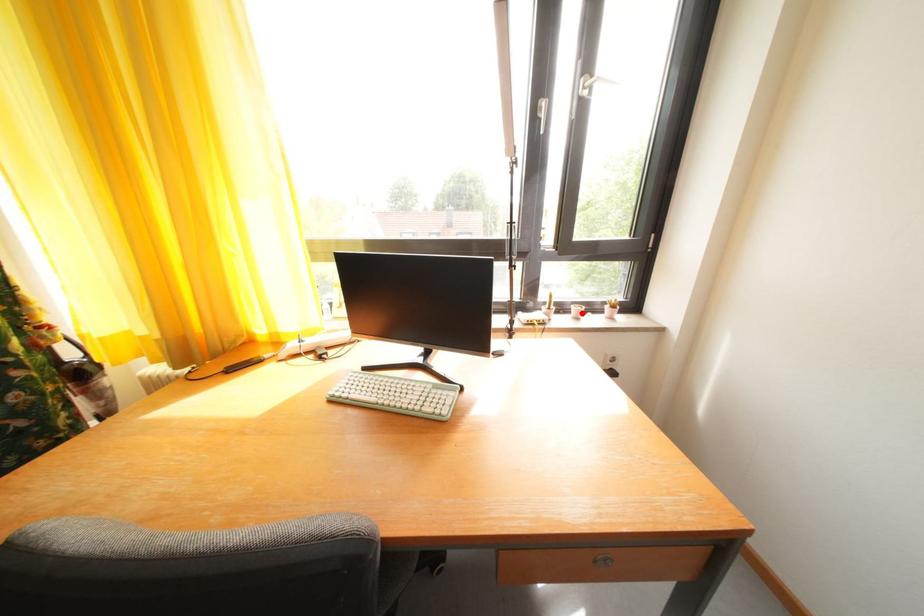
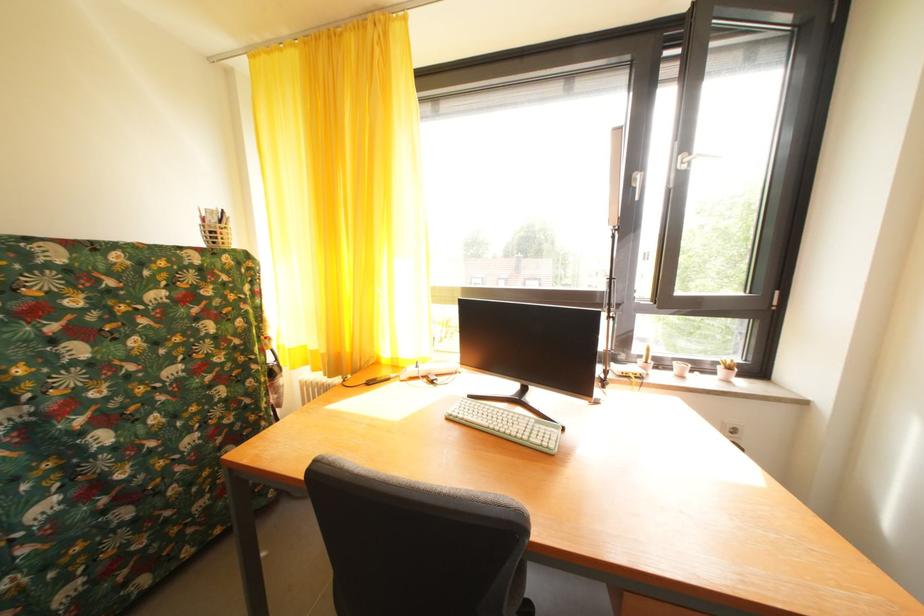
Find the pixel in the second image that matches the highlighted location in the first image.

(685, 370)